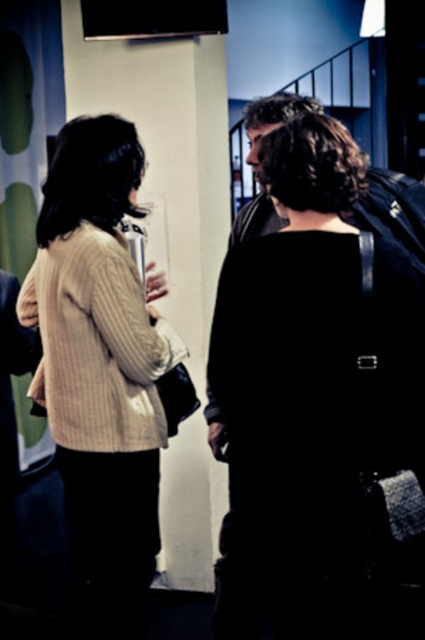
Can you confirm if black matte backpack at center is positioned below beige ribbed sweater at center?

Indeed, black matte backpack at center is positioned under beige ribbed sweater at center.

Who is more distant from viewer, (229, 477) or (93, 230)?

The point (93, 230) is behind.

What are the coordinates of `black matte backpack at center` in the screenshot? It's located at [x=289, y=392].

Can you confirm if beige ribbed sweater at center is positioned to the left of knitted beige sweater at left?

Incorrect, beige ribbed sweater at center is not on the left side of knitted beige sweater at left.

Can you confirm if beige ribbed sweater at center is positioned above knitted beige sweater at left?

Yes, beige ribbed sweater at center is above knitted beige sweater at left.

Is point (136, 408) in front of point (2, 403)?

Yes, it is in front of point (2, 403).

At what (x,y) coordinates should I click in order to perform the action: click on beige ribbed sweater at center. Please return your answer as a coordinate pair (x, y). Image resolution: width=425 pixels, height=640 pixels. Looking at the image, I should click on 96,344.

Which is above, black matte backpack at center or knitted beige sweater at center?

knitted beige sweater at center is higher up.

Does black matte backpack at center have a greater width compared to knitted beige sweater at center?

No, black matte backpack at center is not wider than knitted beige sweater at center.

Between point (286, 218) and point (51, 168), which one is positioned behind?

The point (286, 218) is behind.

This screenshot has height=640, width=425. Identify the location of black matte backpack at center. (289, 392).